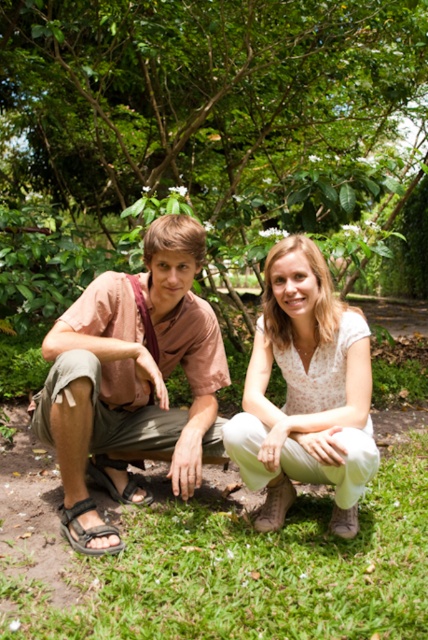
Question: Where is green grass at lower center located in relation to brown leather sandal at lower left in the image?

Choices:
 (A) above
 (B) below

Answer: (B)

Question: Estimate the real-world distances between objects in this image. Which object is closer to the light brown cotton shirt at left?

Choices:
 (A) white floral blouse at center
 (B) green grass at lower center
 (C) brown leather sandal at lower left
 (D) black fabric sandal at lower left

Answer: (D)

Question: Which point appears farthest from the camera in this image?

Choices:
 (A) (86, 301)
 (B) (80, 531)

Answer: (A)

Question: Can you confirm if light brown cotton shirt at left is positioned to the left of brown leather sandal at lower left?

Choices:
 (A) yes
 (B) no

Answer: (B)

Question: Considering the relative positions of green grass at lower center and light brown cotton shirt at left in the image provided, where is green grass at lower center located with respect to light brown cotton shirt at left?

Choices:
 (A) left
 (B) right

Answer: (B)

Question: Which of the following is the farthest from the observer?

Choices:
 (A) green grass at lower center
 (B) brown leather sandal at lower left

Answer: (B)